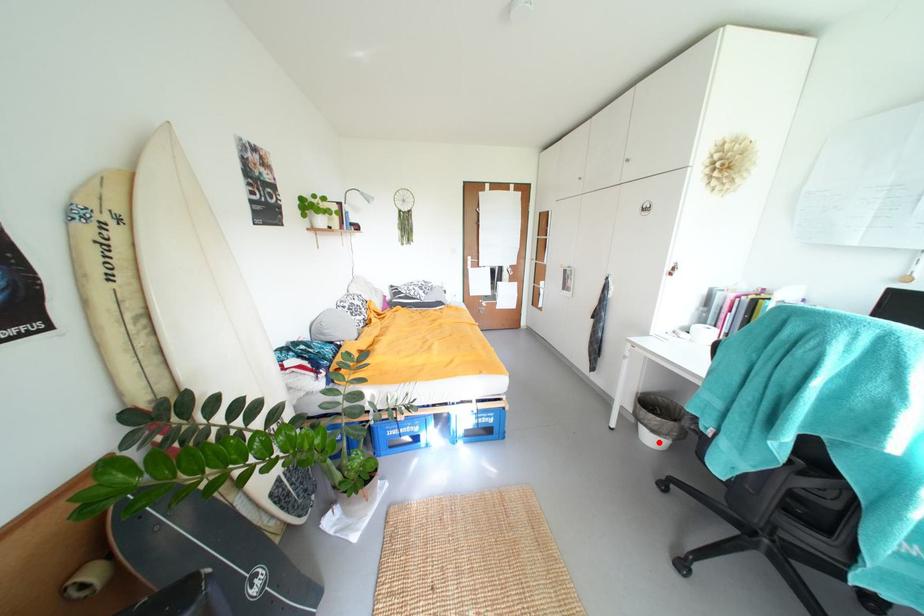
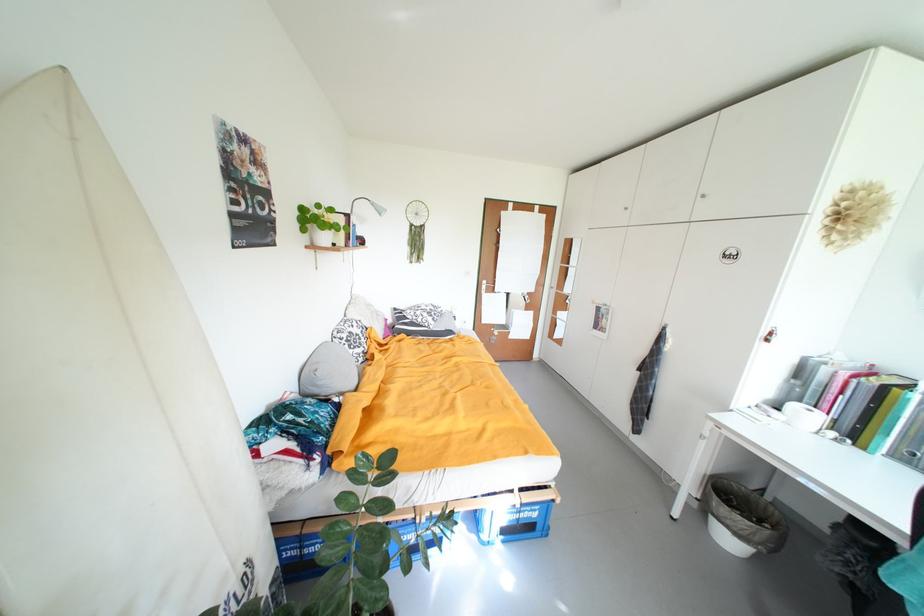
Locate, in the second image, the point that corresponds to the highlighted location in the first image.

(736, 544)